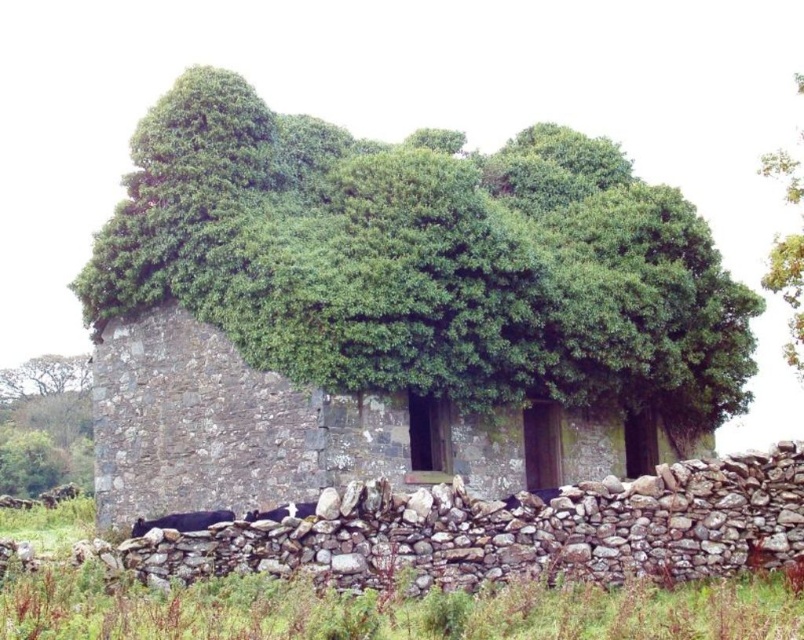
You are a gardener trying to assess the growth of the trees around the old stone building. Which of the two trees, the green leafy tree at center or the green leafy tree at upper left, would require more space due to its size?

The green leafy tree at center is bigger than the green leafy tree at upper left, so it would require more space due to its larger size.

You are standing in front of the old stone building and notice two green leafy trees. Which tree, the green leafy tree at center or the green leafy tree at upper right, is taller?

The green leafy tree at upper right is taller than the green leafy tree at center.

You are standing at the origin point of the scene. Where is the green leafy tree at center located in terms of coordinates?

The green leafy tree at center is located at coordinates point (x=425, y=262).